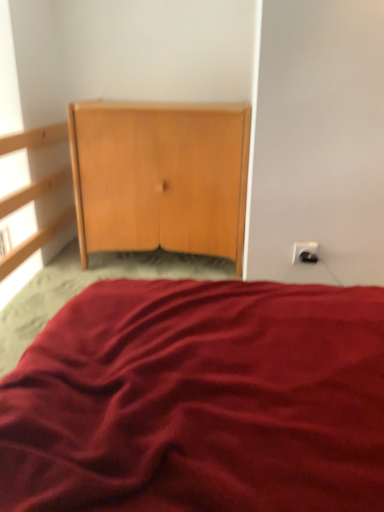
Question: From a real-world perspective, is light wood/texture cupboard at center positioned above or below white plastic electric outlet at right?

Choices:
 (A) below
 (B) above

Answer: (B)

Question: From the image's perspective, is light wood/texture cupboard at center positioned above or below white plastic electric outlet at right?

Choices:
 (A) below
 (B) above

Answer: (B)

Question: In terms of width, does light wood/texture cupboard at center look wider or thinner when compared to white plastic electric outlet at right?

Choices:
 (A) wide
 (B) thin

Answer: (A)

Question: From the image's perspective, is white plastic electric outlet at right located above or below light wood/texture cupboard at center?

Choices:
 (A) below
 (B) above

Answer: (A)

Question: Considering the positions of point (306, 253) and point (122, 219), is point (306, 253) closer or farther from the camera than point (122, 219)?

Choices:
 (A) closer
 (B) farther

Answer: (A)

Question: Based on their positions, is white plastic electric outlet at right located to the left or right of light wood/texture cupboard at center?

Choices:
 (A) right
 (B) left

Answer: (A)

Question: In terms of size, does white plastic electric outlet at right appear bigger or smaller than light wood/texture cupboard at center?

Choices:
 (A) big
 (B) small

Answer: (B)